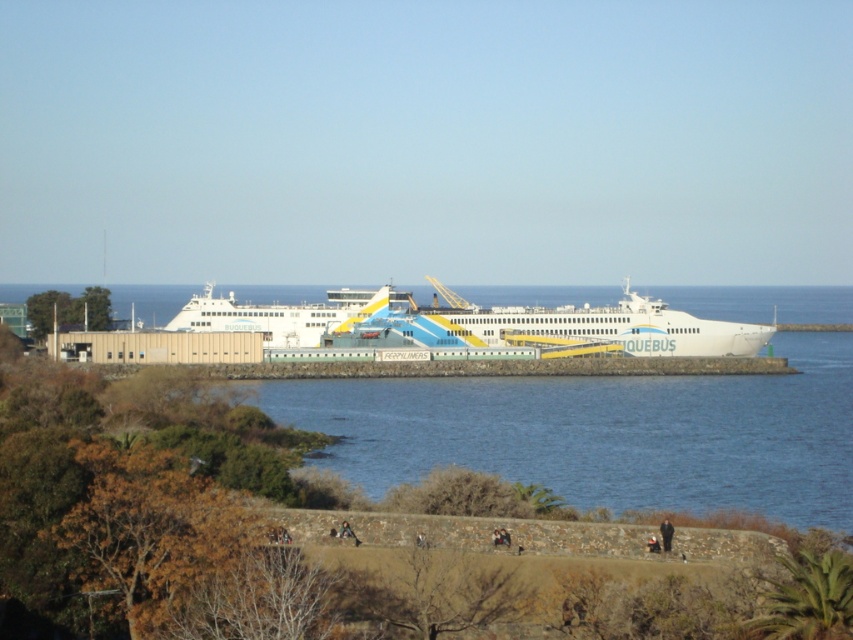
You are standing on the grassy embankment near the black fabric person at lower right and want to board the white glossy ferry at center. Which direction should you walk to reach the ferry?

You should walk to the left to reach the white glossy ferry at center since it is located to the left of the black fabric person at lower right.

You are a photographer trying to capture the white glossy ferry at center and the black fabric person at lower right in the same frame. Based on their sizes in the image, which one appears larger?

The white glossy ferry at center appears larger than the black fabric person at lower right because it is wider.